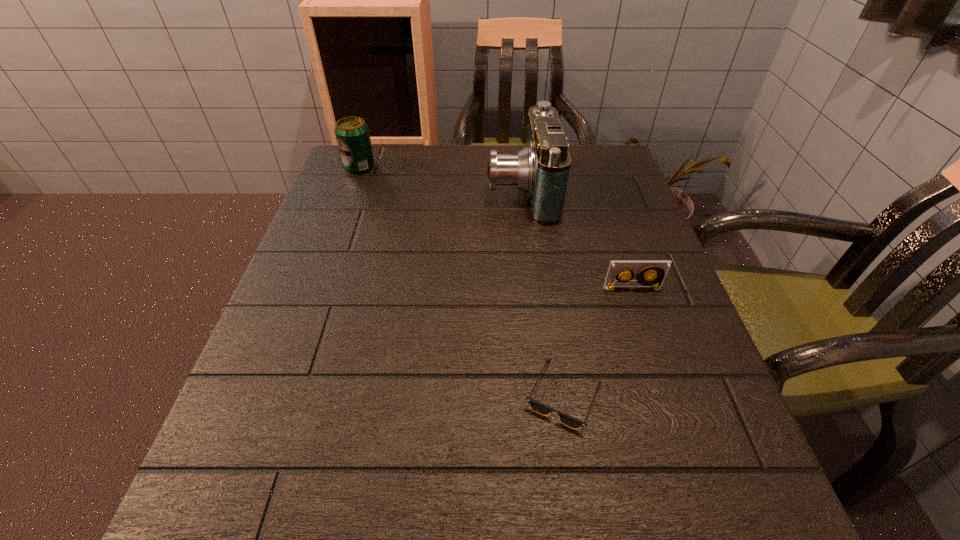
Identify the location of the tallest object. This screenshot has width=960, height=540. (541, 169).

Find the location of a particular element. This screenshot has height=540, width=960. beer can is located at coordinates (352, 134).

You are a GUI agent. You are given a task and a screenshot of the screen. Output one action in this format:
    pyautogui.click(x=<x>, y=<y>)
    Task: Click on the leftmost object
    This screenshot has width=960, height=540.
    Given the screenshot: What is the action you would take?
    pyautogui.click(x=352, y=134)

Where is `the rightmost object`? The height and width of the screenshot is (540, 960). the rightmost object is located at coordinates (658, 270).

You are a GUI agent. You are given a task and a screenshot of the screen. Output one action in this format:
    pyautogui.click(x=<x>, y=<y>)
    Task: Click on the second shortest object
    This screenshot has width=960, height=540.
    Given the screenshot: What is the action you would take?
    pyautogui.click(x=658, y=270)

Image resolution: width=960 pixels, height=540 pixels. I want to click on sunglasses, so click(572, 422).

The image size is (960, 540). Find the location of `the nearest object`. the nearest object is located at coordinates (572, 422).

This screenshot has width=960, height=540. I want to click on vacant space located on the front-facing side of the tallest object, so click(415, 190).

Identify the location of vacant area situated on the front-facing side of the tallest object. (419, 190).

At what (x,y) coordinates should I click in order to perform the action: click on vacant space located on the front-facing side of the tallest object. Please return your answer as a coordinate pair (x, y). Looking at the image, I should click on (339, 190).